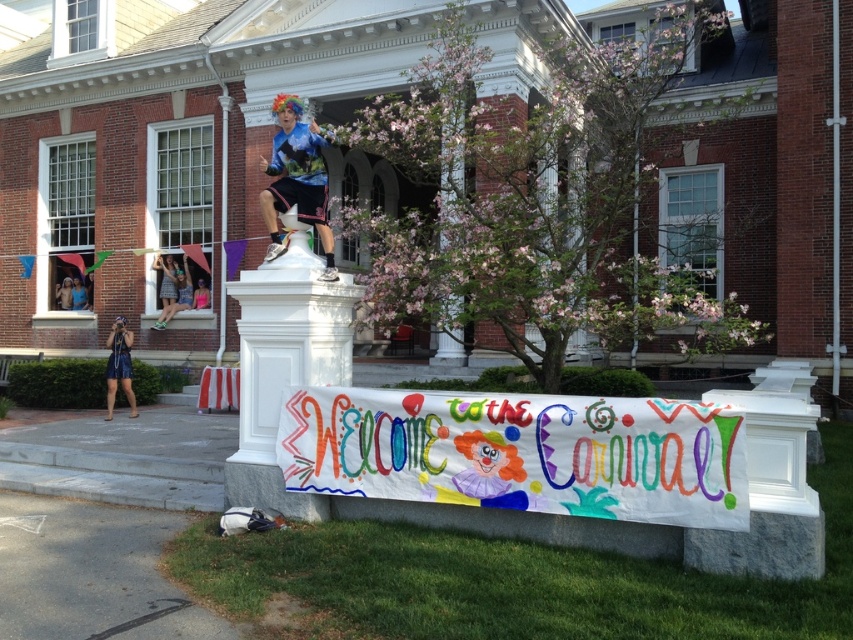
You are a photographer standing in front of the building and want to capture both the shiny silver helmet at upper center and the neon pink fabric at upper center in the same frame. Which object should you position your camera to the left of to ensure both are visible?

You should position your camera to the left of the neon pink fabric at upper center because the shiny silver helmet at upper center is on its left side, so capturing the neon pink fabric on the right side of the frame will include the helmet on the left.

You are a photographer standing at the base of the wall. You want to take a photo that includes both the blue denim shorts at center and the shiny silver helmet at upper center. What is the minimum distance you need to move forward or backward to ensure both objects are in frame?

The distance between the blue denim shorts at center and the shiny silver helmet at upper center is 8.09 inches. To include both in the frame, you should position yourself so that the camera can capture this 8.09 inch separation between the two objects. Adjust your distance based on your camera lens and sensor size to ensure both are in focus and within the frame.

You are standing in front of the building and see the point marked at coordinates (64, 292). Based on the scene description, what object is this point located on?

The point at (64, 292) is located on the shiny silver helmet at upper center.